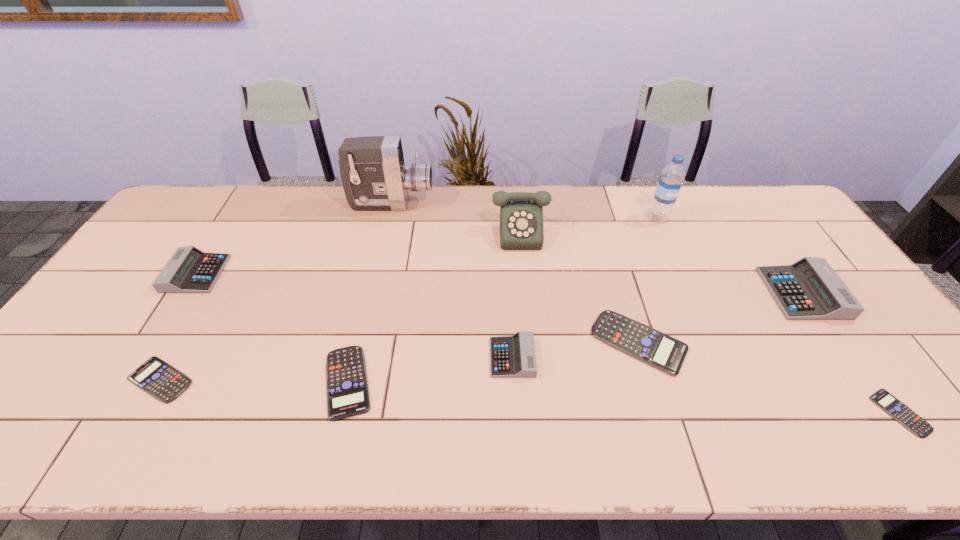
This screenshot has width=960, height=540. Find the location of `camcorder`. camcorder is located at coordinates (374, 176).

The image size is (960, 540). Find the location of `water bottle`. water bottle is located at coordinates (671, 179).

I want to click on blue water bottle, so pos(671,179).

The height and width of the screenshot is (540, 960). What are the coordinates of `the eighth shortest object` in the screenshot? It's located at (521, 213).

In order to click on the fourth tallest object in this screenshot , I will do `click(809, 289)`.

The image size is (960, 540). What are the coordinates of `the rightmost gray calculator` in the screenshot? It's located at (809, 289).

I want to click on the fifth tallest object, so click(x=190, y=270).

At what (x,y) coordinates should I click in order to perform the action: click on the leftmost gray calculator. Please return your answer as a coordinate pair (x, y). Looking at the image, I should click on (190, 270).

At what (x,y) coordinates should I click in order to perform the action: click on the sixth tallest object. Please return your answer as a coordinate pair (x, y). Looking at the image, I should click on [514, 356].

At what (x,y) coordinates should I click in order to perform the action: click on the fourth calculator from left to right. Please return your answer as a coordinate pair (x, y). The width and height of the screenshot is (960, 540). Looking at the image, I should click on (514, 356).